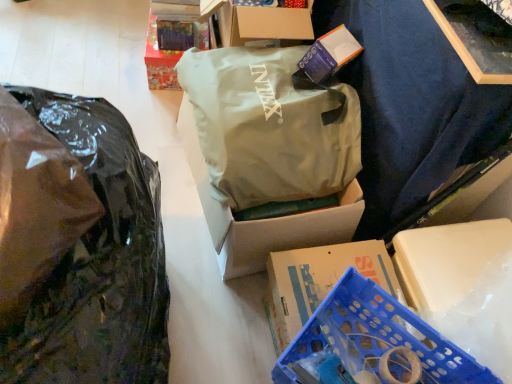
The image size is (512, 384). What are the coordinates of `blue plastic crate at lower right` in the screenshot? It's located at (373, 344).

You are a GUI agent. You are given a task and a screenshot of the screen. Output one action in this format:
    pyautogui.click(x=<x>, y=<y>)
    Task: Click on the blue plastic crate at lower right
    Image resolution: width=512 pixels, height=384 pixels.
    Given the screenshot: What is the action you would take?
    pyautogui.click(x=462, y=285)

The image size is (512, 384). What do you see at coordinates (170, 46) in the screenshot?
I see `shiny paper box at upper left` at bounding box center [170, 46].

This screenshot has height=384, width=512. What do you see at coordinates (78, 245) in the screenshot?
I see `transparent plastic bag at left, which ranks as the 2th plastic bag in right-to-left order` at bounding box center [78, 245].

The height and width of the screenshot is (384, 512). What are the coordinates of `blue plastic crate at lower right` in the screenshot? It's located at click(x=373, y=344).

Considering the relative positions of blue plastic crate at lower right and blue plastic crate at lower right in the image provided, is blue plastic crate at lower right to the left of blue plastic crate at lower right from the viewer's perspective?

In fact, blue plastic crate at lower right is to the right of blue plastic crate at lower right.

From the image's perspective, is blue plastic crate at lower right on blue plastic crate at lower right?

Yes, from the image's perspective, blue plastic crate at lower right is above blue plastic crate at lower right.

How different are the orientations of blue plastic crate at lower right and blue plastic crate at lower right in degrees?

blue plastic crate at lower right and blue plastic crate at lower right are facing 36.1 degrees away from each other.

How many degrees apart are the facing directions of matte green fabric bag at center, the 1th plastic bag viewed from the right, and shiny paper box at upper left?

The facing directions of matte green fabric bag at center, the 1th plastic bag viewed from the right, and shiny paper box at upper left are 15.3 degrees apart.

Is matte green fabric bag at center, the 1th plastic bag viewed from the right, aimed at shiny paper box at upper left?

No, matte green fabric bag at center, the 1th plastic bag viewed from the right, does not turn towards shiny paper box at upper left.

Does point (208, 168) come behind point (203, 40)?

No, (208, 168) is closer to viewer.

Is matte green fabric bag at center, the 2th plastic bag in the left-to-right sequence, thinner than shiny paper box at upper left?

In fact, matte green fabric bag at center, the 2th plastic bag in the left-to-right sequence, might be wider than shiny paper box at upper left.

Which is more to the right, shiny paper box at upper left or blue plastic crate at lower right?

blue plastic crate at lower right is more to the right.

Which point is more forward, (x=178, y=32) or (x=360, y=341)?

The point (x=360, y=341) is closer to the camera.

From the image's perspective, is shiny paper box at upper left above or below blue plastic crate at lower right?

Based on their image positions, shiny paper box at upper left is located above blue plastic crate at lower right.

Is shiny paper box at upper left not close to blue plastic crate at lower right?

Yes, shiny paper box at upper left and blue plastic crate at lower right are quite far apart.

From the picture: Is blue plastic crate at lower right facing towards matte green fabric bag at center, the 1th plastic bag viewed from the right?

No, blue plastic crate at lower right does not turn towards matte green fabric bag at center, the 1th plastic bag viewed from the right.

The width and height of the screenshot is (512, 384). I want to click on basket located above the matte green fabric bag at center, the 2th plastic bag in the left-to-right sequence (from a real-world perspective), so click(373, 344).

Who is shorter, blue plastic crate at lower right or matte green fabric bag at center, the 2th plastic bag in the left-to-right sequence?

blue plastic crate at lower right is shorter.

Looking at this image, is blue plastic crate at lower right wider than matte green fabric bag at center, the 2th plastic bag in the left-to-right sequence?

In fact, blue plastic crate at lower right might be narrower than matte green fabric bag at center, the 2th plastic bag in the left-to-right sequence.

Is shiny paper box at upper left not inside blue plastic crate at lower right?

Yes.

Could you tell me if shiny paper box at upper left is facing blue plastic crate at lower right?

No.

Which is more to the left, shiny paper box at upper left or blue plastic crate at lower right?

Positioned to the left is shiny paper box at upper left.

Consider the image. From a real-world perspective, which is physically below, transparent plastic bag at left, which ranks as the 2th plastic bag in right-to-left order, or matte green fabric bag at center, the 1th plastic bag viewed from the right?

matte green fabric bag at center, the 1th plastic bag viewed from the right.

Is transparent plastic bag at left, which is counted as the first plastic bag, starting from the left, with matte green fabric bag at center, the 1th plastic bag viewed from the right?

No, transparent plastic bag at left, which is counted as the first plastic bag, starting from the left, is not in contact with matte green fabric bag at center, the 1th plastic bag viewed from the right.

Between transparent plastic bag at left, which is counted as the first plastic bag, starting from the left, and matte green fabric bag at center, the 1th plastic bag viewed from the right, which one has larger width?

Wider between the two is transparent plastic bag at left, which is counted as the first plastic bag, starting from the left.

Is point (15, 200) positioned behind point (286, 96)?

No.

Is transparent plastic bag at left, which ranks as the 2th plastic bag in right-to-left order, far from blue plastic crate at lower right?

transparent plastic bag at left, which ranks as the 2th plastic bag in right-to-left order, is actually quite close to blue plastic crate at lower right.

Considering the sizes of transparent plastic bag at left, which is counted as the first plastic bag, starting from the left, and blue plastic crate at lower right in the image, is transparent plastic bag at left, which is counted as the first plastic bag, starting from the left, bigger or smaller than blue plastic crate at lower right?

Clearly, transparent plastic bag at left, which is counted as the first plastic bag, starting from the left, is larger in size than blue plastic crate at lower right.

Measure the distance from transparent plastic bag at left, which is counted as the first plastic bag, starting from the left, to blue plastic crate at lower right.

transparent plastic bag at left, which is counted as the first plastic bag, starting from the left, is 29.92 inches from blue plastic crate at lower right.

From a real-world perspective, is transparent plastic bag at left, which ranks as the 2th plastic bag in right-to-left order, physically located above or below blue plastic crate at lower right?

transparent plastic bag at left, which ranks as the 2th plastic bag in right-to-left order, is situated higher than blue plastic crate at lower right in the real world.

Find the location of a particular element. storage box above the blue plastic crate at lower right (from the image's perspective) is located at coordinates (462, 285).

From the image's perspective, count 1st plastic bags downward from the shiny paper box at upper left and point to it. Please provide its 2D coordinates.

[(270, 126)]

When comparing their distances from transparent plastic bag at left, which ranks as the 2th plastic bag in right-to-left order, does blue plastic crate at lower right or blue plastic crate at lower right seem further?

The object further to transparent plastic bag at left, which ranks as the 2th plastic bag in right-to-left order, is blue plastic crate at lower right.

Estimate the real-world distances between objects in this image. Which object is further from shiny paper box at upper left, matte green fabric bag at center, the 2th plastic bag in the left-to-right sequence, or transparent plastic bag at left, which is counted as the first plastic bag, starting from the left?

The object further to shiny paper box at upper left is transparent plastic bag at left, which is counted as the first plastic bag, starting from the left.

Looking at the image, which one is located further to transparent plastic bag at left, which is counted as the first plastic bag, starting from the left, shiny paper box at upper left or blue plastic crate at lower right?

shiny paper box at upper left lies further to transparent plastic bag at left, which is counted as the first plastic bag, starting from the left, than the other object.

Estimate the real-world distances between objects in this image. Which object is further from transparent plastic bag at left, which is counted as the first plastic bag, starting from the left, matte green fabric bag at center, the 1th plastic bag viewed from the right, or blue plastic crate at lower right?

The object further to transparent plastic bag at left, which is counted as the first plastic bag, starting from the left, is blue plastic crate at lower right.

Looking at the image, which one is located further to matte green fabric bag at center, the 1th plastic bag viewed from the right, blue plastic crate at lower right or shiny paper box at upper left?

Based on the image, shiny paper box at upper left appears to be further to matte green fabric bag at center, the 1th plastic bag viewed from the right.

Which object lies further to the anchor point blue plastic crate at lower right, shiny paper box at upper left or matte green fabric bag at center, the 1th plastic bag viewed from the right?

Based on the image, shiny paper box at upper left appears to be further to blue plastic crate at lower right.

Estimate the real-world distances between objects in this image. Which object is further from matte green fabric bag at center, the 1th plastic bag viewed from the right, blue plastic crate at lower right or shiny paper box at upper left?

shiny paper box at upper left is positioned further to the anchor matte green fabric bag at center, the 1th plastic bag viewed from the right.

When comparing their distances from blue plastic crate at lower right, does shiny paper box at upper left or transparent plastic bag at left, which ranks as the 2th plastic bag in right-to-left order, seem closer?

transparent plastic bag at left, which ranks as the 2th plastic bag in right-to-left order.

Locate an element on the screen. The width and height of the screenshot is (512, 384). plastic bag between transparent plastic bag at left, which is counted as the first plastic bag, starting from the left, and blue plastic crate at lower right is located at coordinates (270, 126).

Where is `plastic bag between shiny paper box at upper left and blue plastic crate at lower right`? Image resolution: width=512 pixels, height=384 pixels. plastic bag between shiny paper box at upper left and blue plastic crate at lower right is located at coordinates (270, 126).

The image size is (512, 384). What are the coordinates of `plastic bag located between transparent plastic bag at left, which ranks as the 2th plastic bag in right-to-left order, and blue plastic crate at lower right in the left-right direction` in the screenshot? It's located at (270, 126).

The width and height of the screenshot is (512, 384). What are the coordinates of `storage box between shiny paper box at upper left and blue plastic crate at lower right from top to bottom` in the screenshot? It's located at (462, 285).